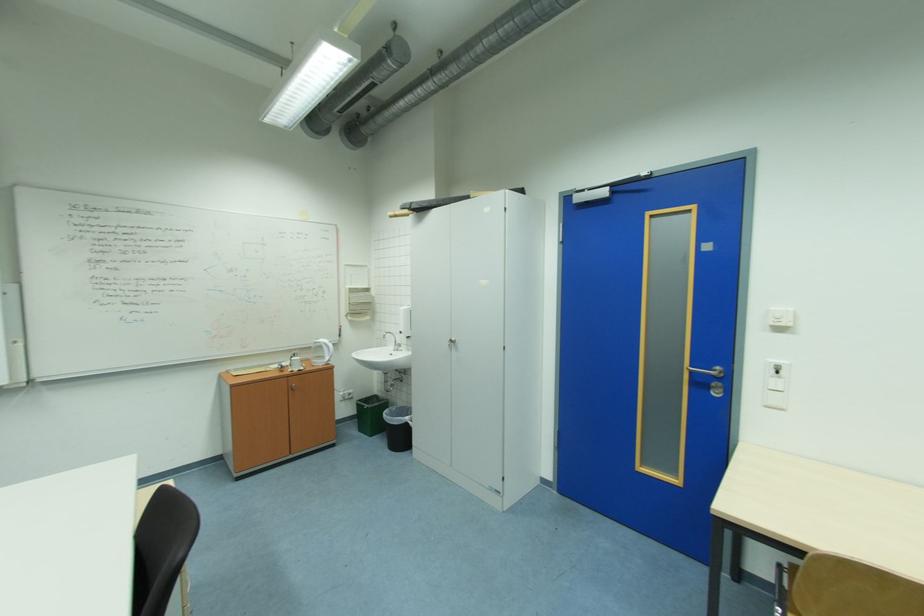
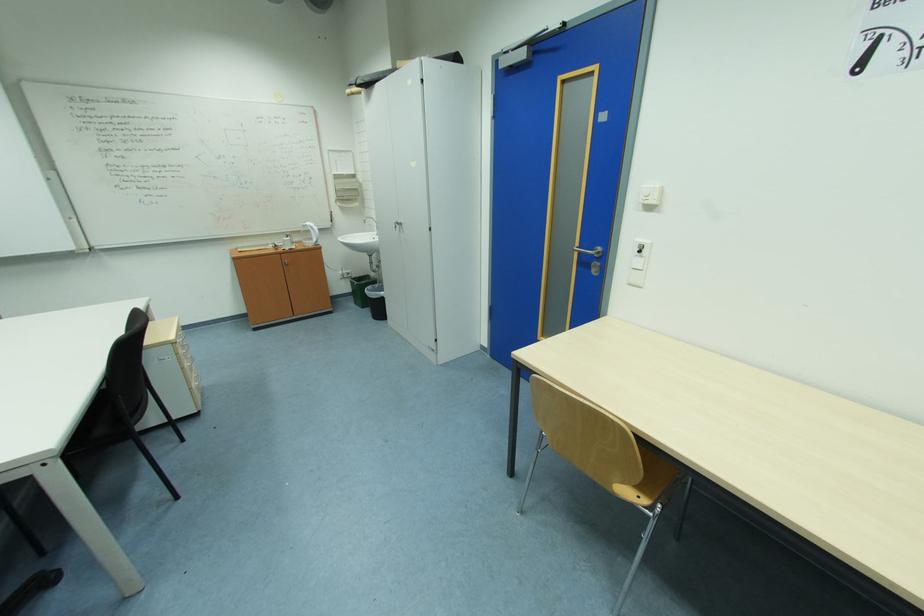
Find the pixel in the second image that matches (779,310) in the first image.

(650, 187)